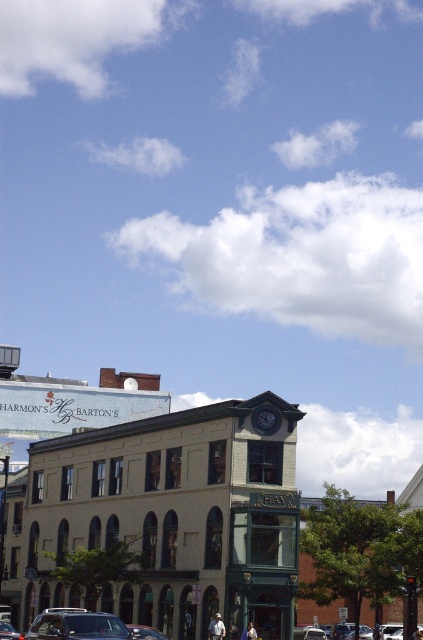
Question: Is beige stone building at center positioned at the back of metallic silver suv at center?

Choices:
 (A) no
 (B) yes

Answer: (B)

Question: Which point is farther from the camera taking this photo?

Choices:
 (A) (54, 618)
 (B) (200, 582)
 (C) (2, 624)

Answer: (B)

Question: Which of the following is the farthest from the observer?

Choices:
 (A) beige stone building at center
 (B) metallic silver car at center

Answer: (A)

Question: Can you confirm if metallic silver suv at center is bigger than metallic silver car at center?

Choices:
 (A) no
 (B) yes

Answer: (B)

Question: From the image, what is the correct spatial relationship of beige stone building at center in relation to metallic silver car at center?

Choices:
 (A) left
 (B) right

Answer: (B)

Question: Which of the following is the closest to the observer?

Choices:
 (A) metallic silver suv at center
 (B) beige stone building at center
 (C) metallic silver car at center

Answer: (A)